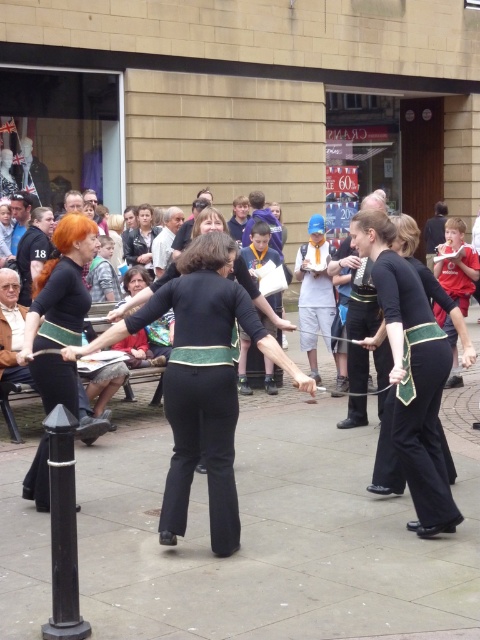
Question: Which object is the farthest from the matte black jacket at center?

Choices:
 (A) matte black pants at center
 (B) black smooth pavement at center

Answer: (B)

Question: Among these points, which one is nearest to the camera?

Choices:
 (A) (219, 269)
 (B) (399, 404)
 (C) (156, 428)

Answer: (A)

Question: Which of the following is the closest to the observer?

Choices:
 (A) (346, 554)
 (B) (407, 435)

Answer: (A)

Question: In this image, where is black smooth pavement at center located relative to matte black dress at center?

Choices:
 (A) above
 (B) below

Answer: (B)

Question: Does black matte pants at center have a lesser width compared to matte black dress at center?

Choices:
 (A) yes
 (B) no

Answer: (B)

Question: Can you confirm if black smooth pavement at center is smaller than matte black jacket at center?

Choices:
 (A) no
 (B) yes

Answer: (B)